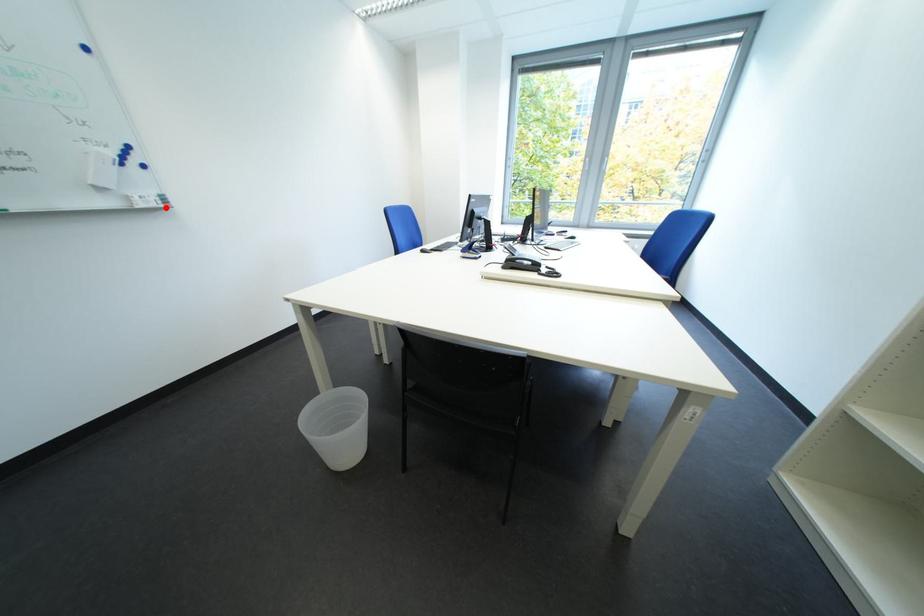
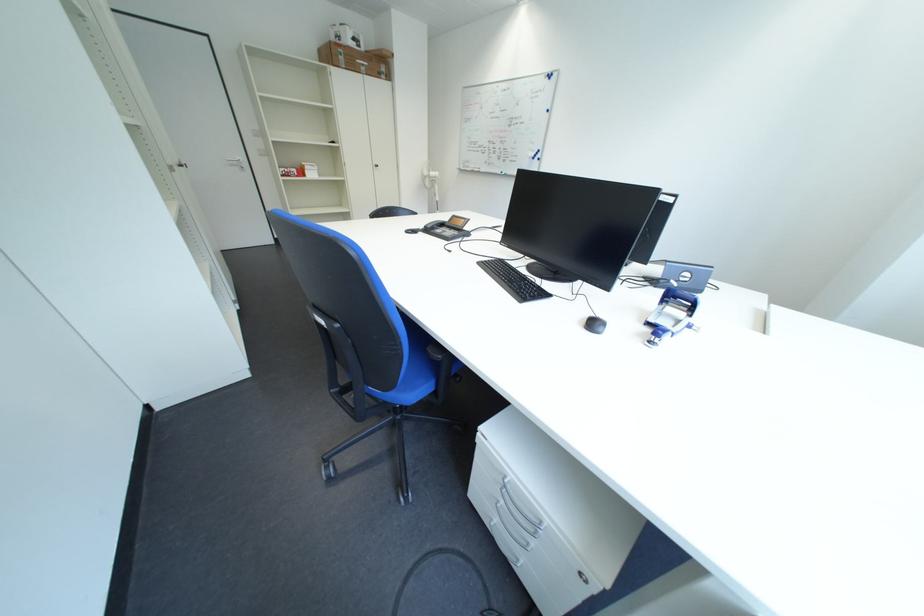
Question: I am providing you with two images of the same scene from different viewpoints. A red point is marked on the first image. At the location where the point appears in image 1, is it still visible in image 2?

Choices:
 (A) Yes
 (B) No

Answer: (B)